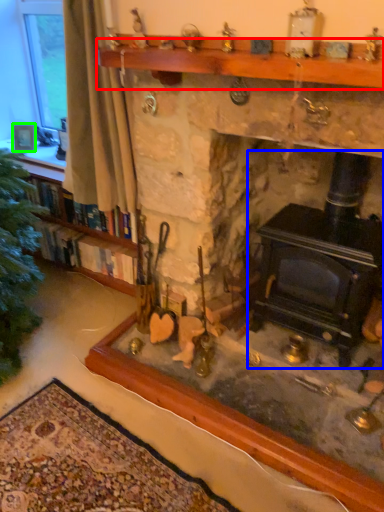
Question: Estimate the real-world distances between objects in this image. Which object is closer to mantle (highlighted by a red box), wood burning stove (highlighted by a blue box) or picture frame (highlighted by a green box)?

Choices:
 (A) wood burning stove
 (B) picture frame

Answer: (A)